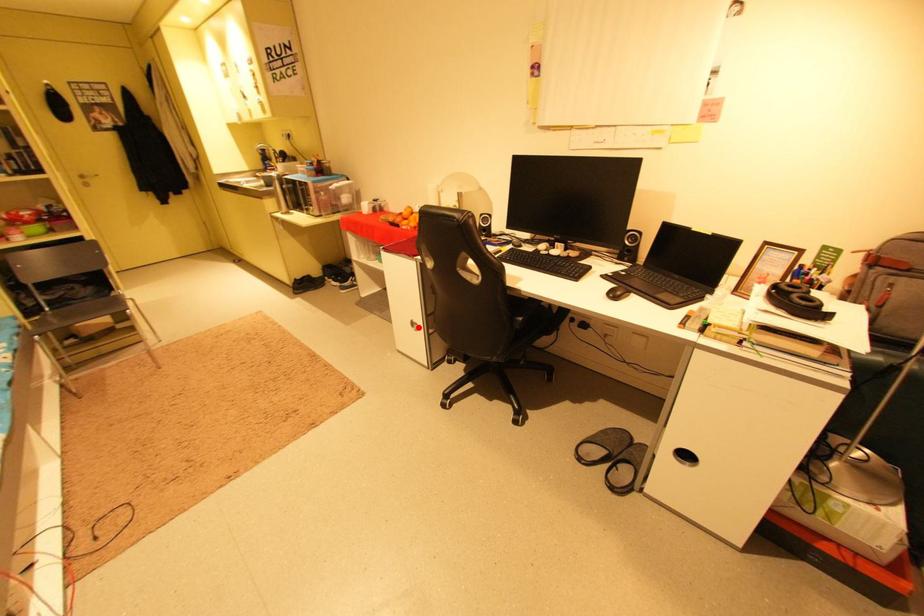
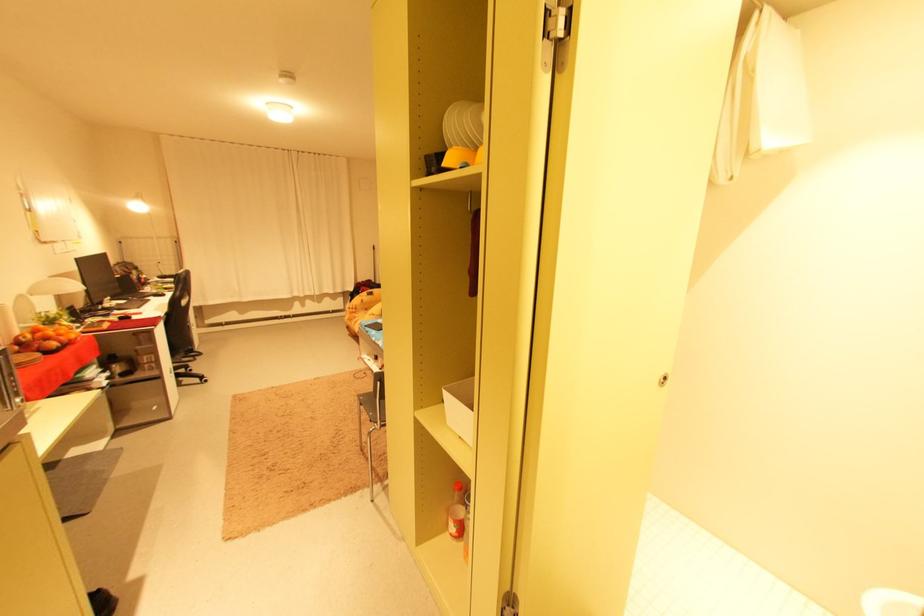
Where in the second image is the point corresponding to the highlighted location from the first image?

(179, 376)